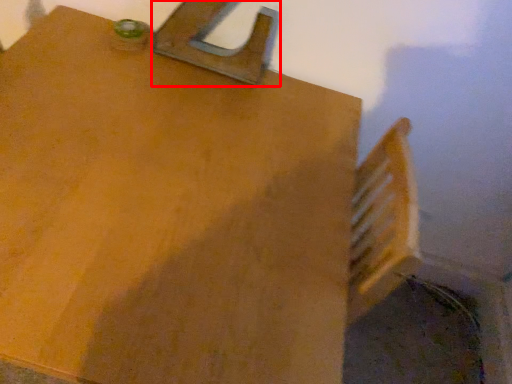
Question: From the image's perspective, where is latch (annotated by the red box) located relative to table?

Choices:
 (A) above
 (B) below

Answer: (A)